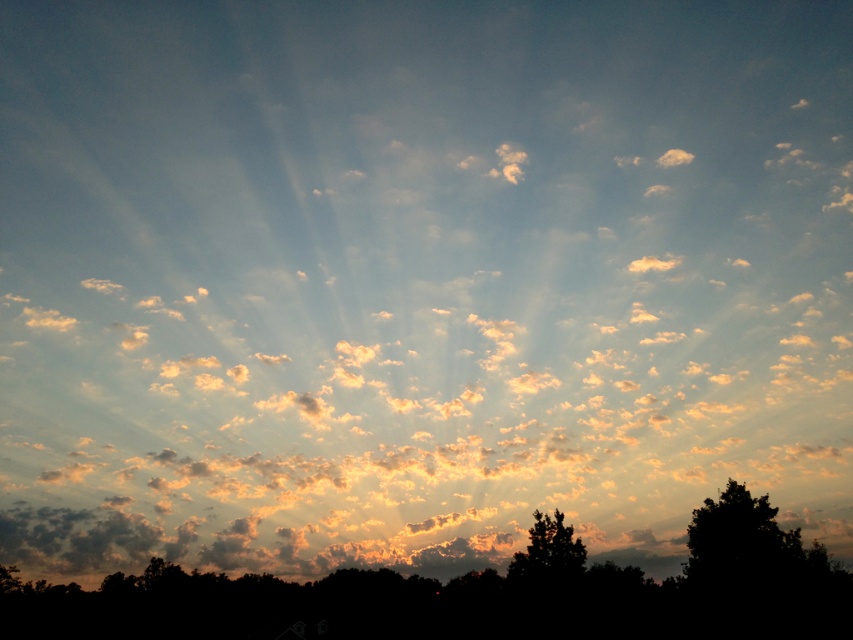
Question: Does silhouette tree at lower center have a larger size compared to silhouette tree at lower right?

Choices:
 (A) yes
 (B) no

Answer: (A)

Question: Which point is farther from the camera taking this photo?

Choices:
 (A) (558, 570)
 (B) (790, 592)

Answer: (A)

Question: Does silhouette tree at lower center appear on the left side of silhouette tree at lower right?

Choices:
 (A) no
 (B) yes

Answer: (B)

Question: Considering the relative positions of silhouette tree at lower center and silhouette tree at lower right in the image provided, where is silhouette tree at lower center located with respect to silhouette tree at lower right?

Choices:
 (A) below
 (B) above

Answer: (A)

Question: Which object is closer to the camera taking this photo?

Choices:
 (A) silhouette tree at lower right
 (B) silhouette tree at lower center

Answer: (B)